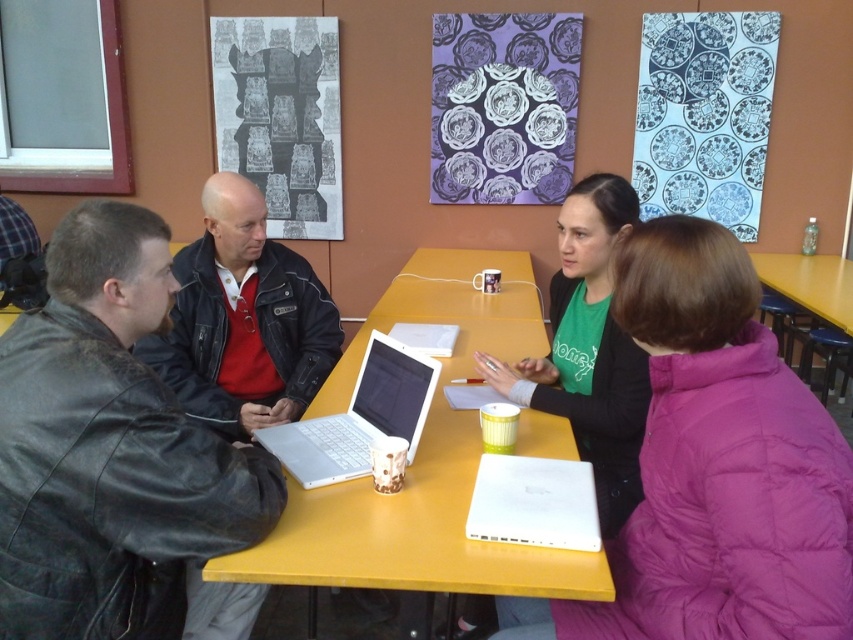
You are a guest entering the room and want to place your bag on the yellow matte table at center without moving the white plastic laptop at center. Is this possible?

The yellow matte table at center is to the right of the white plastic laptop at center, so there is space to place the bag on the table without moving the laptop.

You are standing at the entrance of the room and see two points marked on the floor at coordinates point (x=102, y=496) and point (x=328, y=445). Which point is closer to you?

Point (x=102, y=496) is in front of point (x=328, y=445), so it is closer to you.

You are sitting at the yellow matte table at center and want to place your white plastic laptop at center on the table. Can you do that without moving any other objects?

The yellow matte table at center is in front of the white plastic laptop at center, so the laptop is not currently on the table. You would need to move it to place it there.